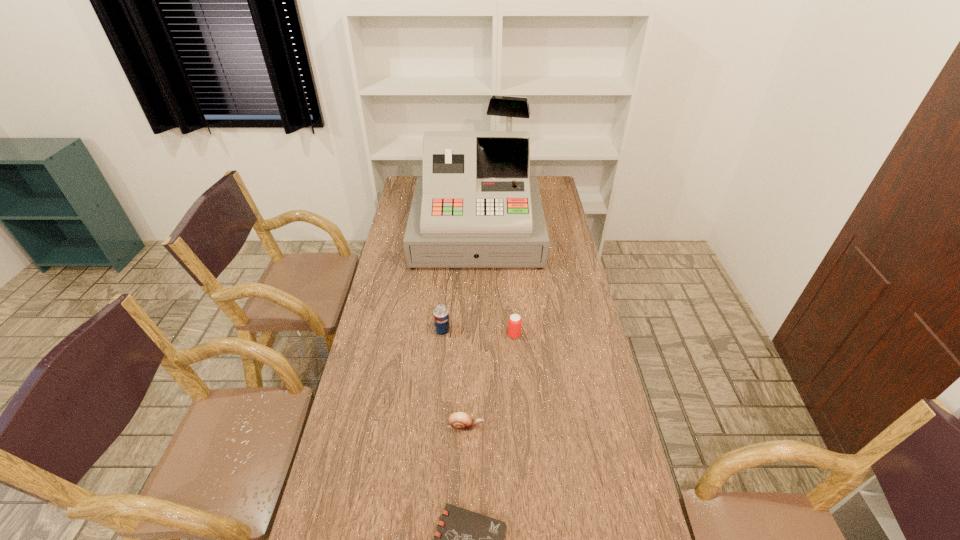
Image resolution: width=960 pixels, height=540 pixels. Identify the location of vacant point located between the left beer can and the second nearest object. (454, 379).

Locate an element on the screen. This screenshot has height=540, width=960. free space between the third shortest object and the taller beer can is located at coordinates (478, 333).

The height and width of the screenshot is (540, 960). I want to click on free space between the cash register and the escargot, so click(471, 330).

Find the location of a particular element. object that can be found as the closest to the tallest object is located at coordinates (440, 313).

Identify which object is located as the nearest to the shortest object. Please provide its 2D coordinates. Your answer should be formatted as a tuple, i.e. [(x, y)], where the tuple contains the x and y coordinates of a point satisfying the conditions above.

[(461, 421)]

You are a GUI agent. You are given a task and a screenshot of the screen. Output one action in this format:
    pyautogui.click(x=<x>, y=<y>)
    Task: Click on the free location that satisfies the following two spatial constraints: 1. on the front side of the third shortest object; 2. on the front-facing side of the second nearest object
    The height and width of the screenshot is (540, 960).
    Given the screenshot: What is the action you would take?
    pyautogui.click(x=521, y=427)

The image size is (960, 540). Find the location of `vacant space that satisfies the following two spatial constraints: 1. on the keypad side of the tallest object; 2. on the front-facing side of the escargot`. vacant space that satisfies the following two spatial constraints: 1. on the keypad side of the tallest object; 2. on the front-facing side of the escargot is located at coordinates (475, 427).